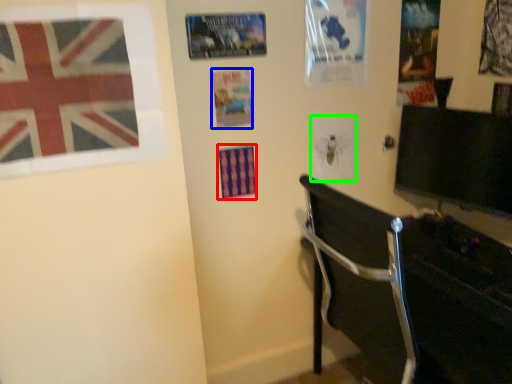
Question: Which is farther away from poster (highlighted by a red box)? poster page (highlighted by a blue box) or poster page (highlighted by a green box)?

Choices:
 (A) poster page
 (B) poster page

Answer: (B)